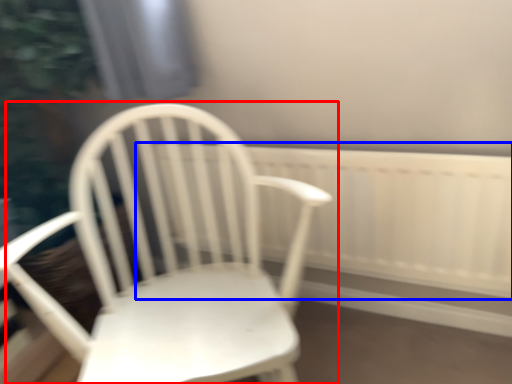
Question: Which object is closer to the camera taking this photo, chair (highlighted by a red box) or radiator (highlighted by a blue box)?

Choices:
 (A) chair
 (B) radiator

Answer: (A)